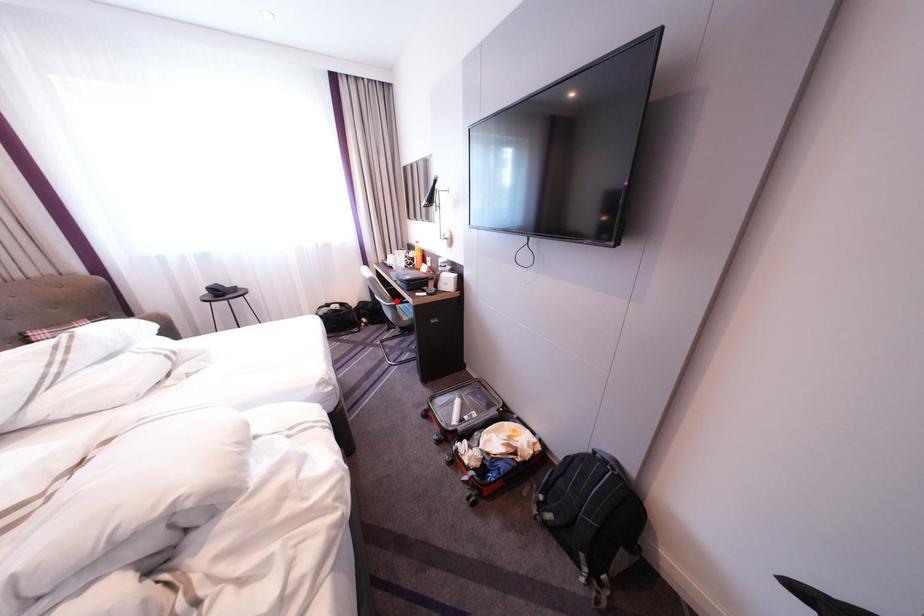
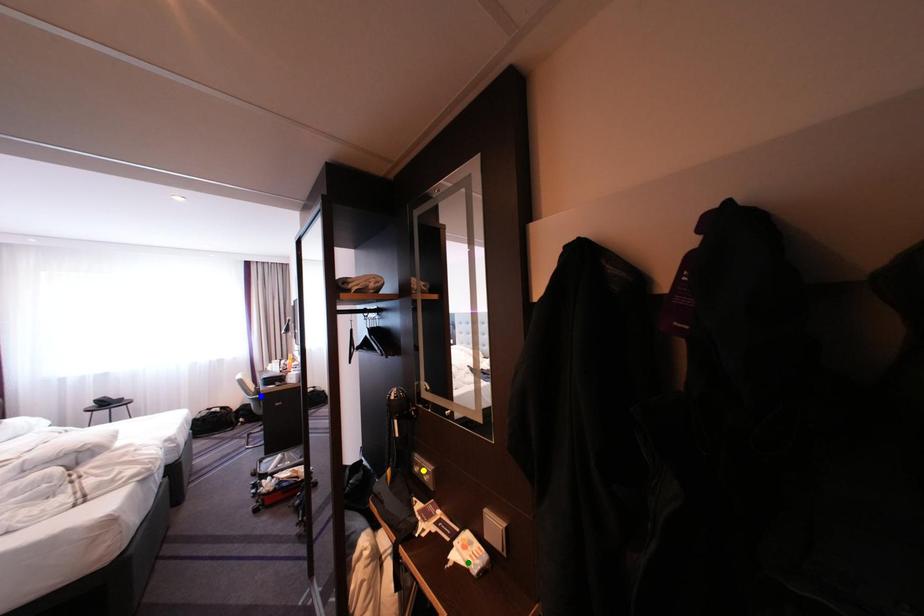
Question: I am providing you with two images of the same scene from different viewpoints. A red point is marked on the first image. You are given multiple points on the second image. In image 2, which mark is for the same physical point as the one in image 1?

Choices:
 (A) yellow point
 (B) blue point
 (C) green point

Answer: (B)